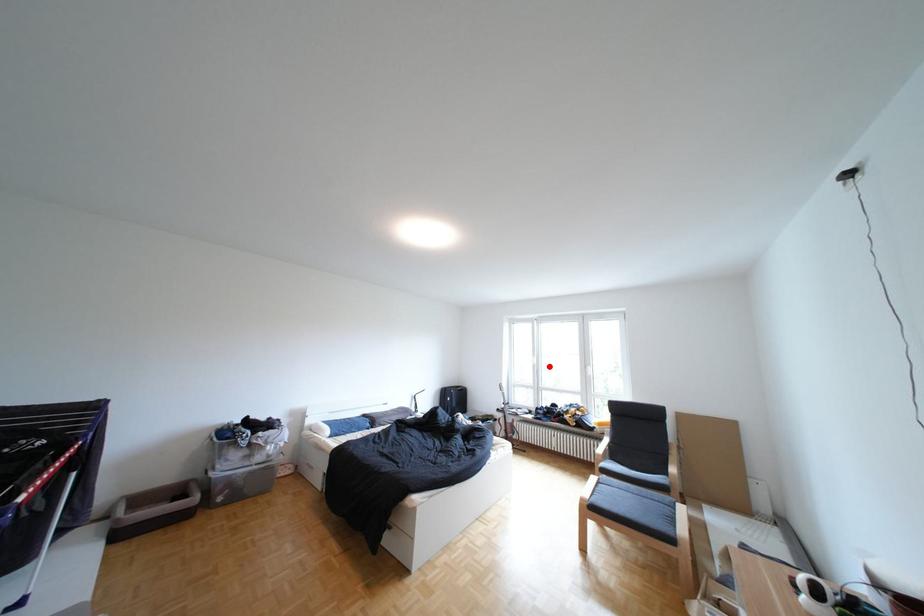
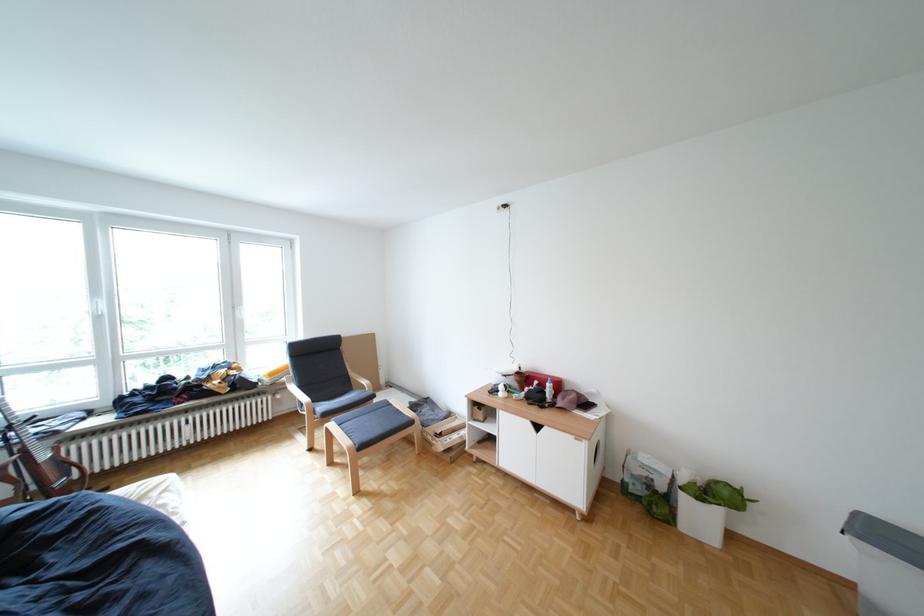
Question: I am providing you with two images of the same scene from different viewpoints. Given a red point in image1, look at the same physical point in image2. Is it:

Choices:
 (A) Closer to the viewpoint
 (B) Farther from the viewpoint

Answer: (A)